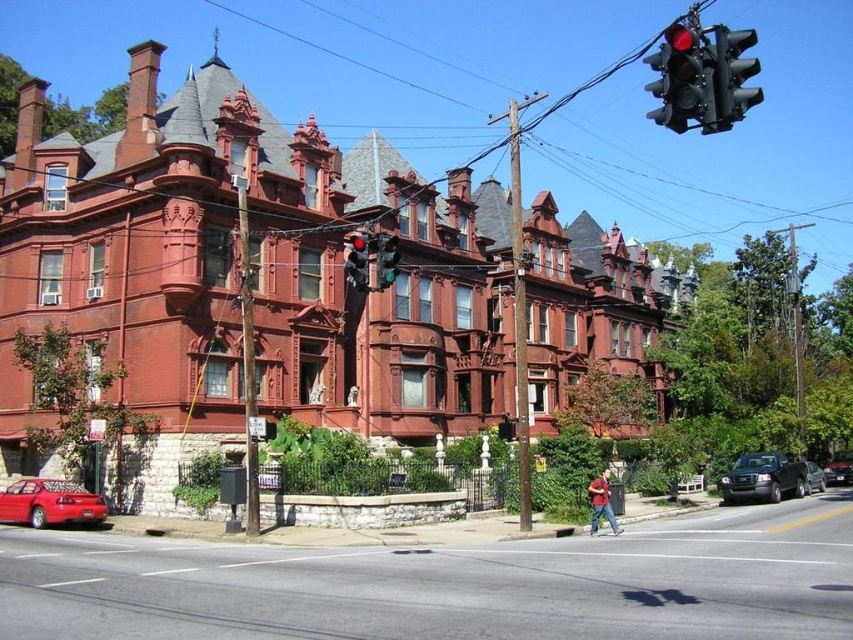
Consider the image. Does reddish-brown leather jacket at lower right lie behind shiny black sedan at center right?

No.

Which is behind, point (590, 492) or point (809, 486)?

Positioned behind is point (809, 486).

Is point (592, 516) positioned after point (814, 477)?

No, it is not.

Identify the location of reddish-brown leather jacket at lower right. The image size is (853, 640). (601, 502).

Does shiny red sedan at lower left appear on the left side of green glass traffic light at center?

Indeed, shiny red sedan at lower left is positioned on the left side of green glass traffic light at center.

Which is more to the left, shiny red sedan at lower left or green glass traffic light at center?

Positioned to the left is shiny red sedan at lower left.

The height and width of the screenshot is (640, 853). Find the location of `shiny red sedan at lower left`. shiny red sedan at lower left is located at coordinates (49, 502).

Between metallic red traffic light at upper right and black matte truck at lower right, which one is positioned lower?

black matte truck at lower right is below.

What do you see at coordinates (677, 77) in the screenshot? I see `metallic red traffic light at upper right` at bounding box center [677, 77].

Where is `metallic red traffic light at upper right`? The image size is (853, 640). metallic red traffic light at upper right is located at coordinates (677, 77).